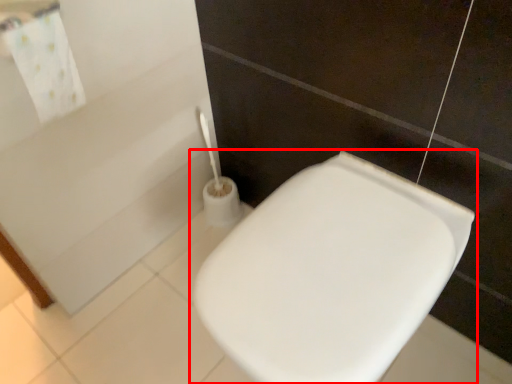
Question: Considering the relative positions of toilet (annotated by the red box) and bath towel in the image provided, where is toilet (annotated by the red box) located with respect to the staircase?

Choices:
 (A) right
 (B) left

Answer: (A)